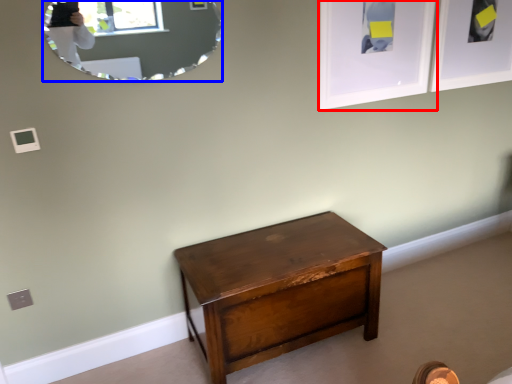
Question: Which of the following is the closest to the observer, picture frame (highlighted by a red box) or mirror (highlighted by a blue box)?

Choices:
 (A) picture frame
 (B) mirror

Answer: (B)